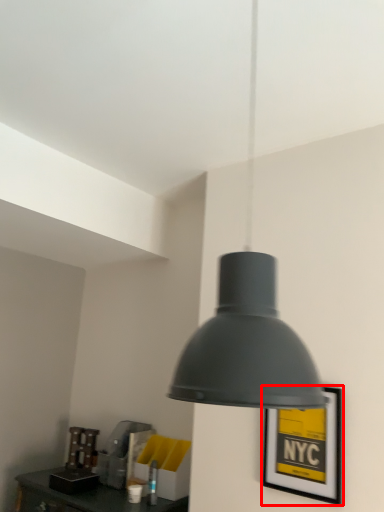
Question: Considering the relative positions of picture frame (annotated by the red box) and lamp in the image provided, where is picture frame (annotated by the red box) located with respect to the staircase?

Choices:
 (A) left
 (B) right

Answer: (B)